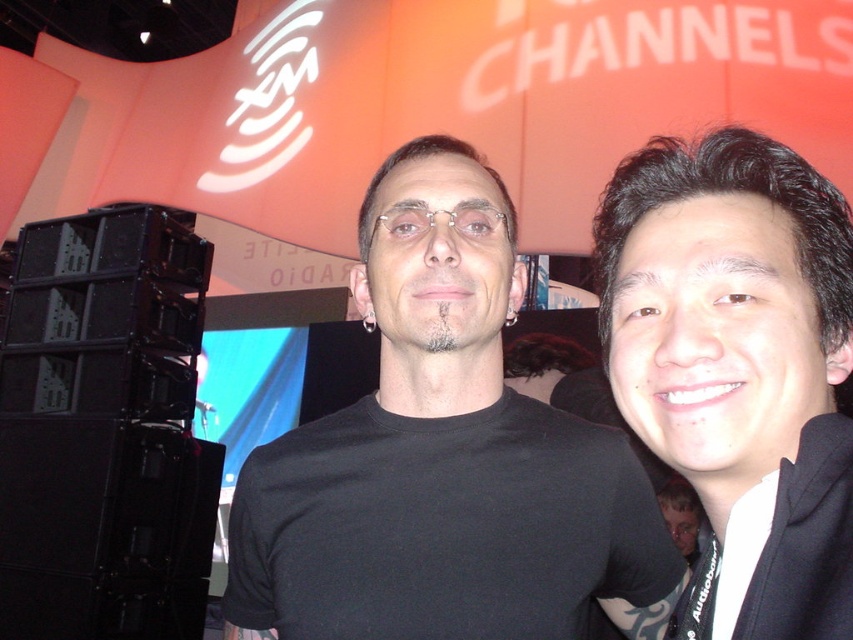
Question: Which point is farther from the camera taking this photo?

Choices:
 (A) (675, 525)
 (B) (772, 244)
 (C) (730, 566)
 (D) (292, 518)

Answer: (A)

Question: Does black matte t-shirt at center have a lesser width compared to matte black face at center?

Choices:
 (A) yes
 (B) no

Answer: (B)

Question: Can you confirm if white matte hoodie at right is positioned to the right of smooth skin face at center?

Choices:
 (A) no
 (B) yes

Answer: (A)

Question: Is black hoodie at right to the left of smooth skin face at center from the viewer's perspective?

Choices:
 (A) yes
 (B) no

Answer: (A)

Question: Which object is positioned farthest from the smooth skin face at right?

Choices:
 (A) black matte t-shirt at center
 (B) smooth skin face at center

Answer: (B)

Question: Which point is farther from the camera taking this photo?

Choices:
 (A) tap(637, 368)
 (B) tap(488, 250)

Answer: (B)